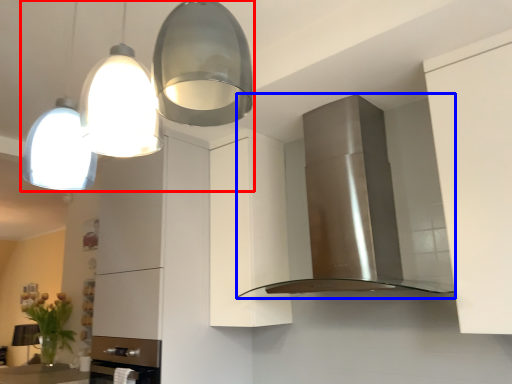
Question: Which object appears closest to the camera in this image, light fixture (highlighted by a red box) or home appliance (highlighted by a blue box)?

Choices:
 (A) light fixture
 (B) home appliance

Answer: (A)